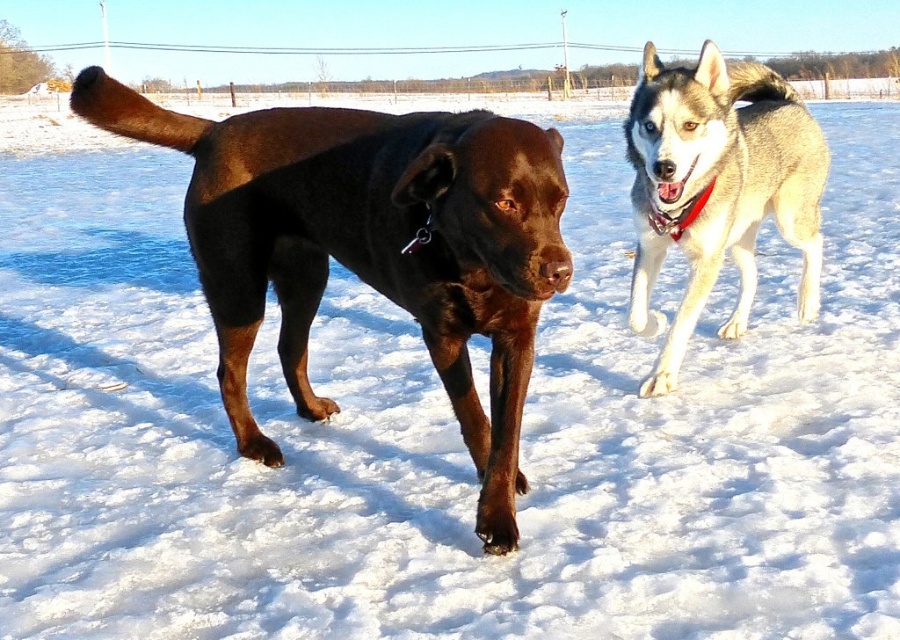
Question: Considering the relative positions of shiny dark brown dog at center and silver-gray fur husky at upper right in the image provided, where is shiny dark brown dog at center located with respect to silver-gray fur husky at upper right?

Choices:
 (A) below
 (B) above

Answer: (A)

Question: Which object appears farthest from the camera in this image?

Choices:
 (A) shiny dark brown dog at center
 (B) silver-gray fur husky at upper right

Answer: (B)

Question: Does shiny dark brown dog at center have a lesser width compared to silver-gray fur husky at upper right?

Choices:
 (A) yes
 (B) no

Answer: (B)

Question: Which point is closer to the camera taking this photo?

Choices:
 (A) (799, 236)
 (B) (225, 216)

Answer: (B)

Question: Is shiny dark brown dog at center below silver-gray fur husky at upper right?

Choices:
 (A) yes
 (B) no

Answer: (A)